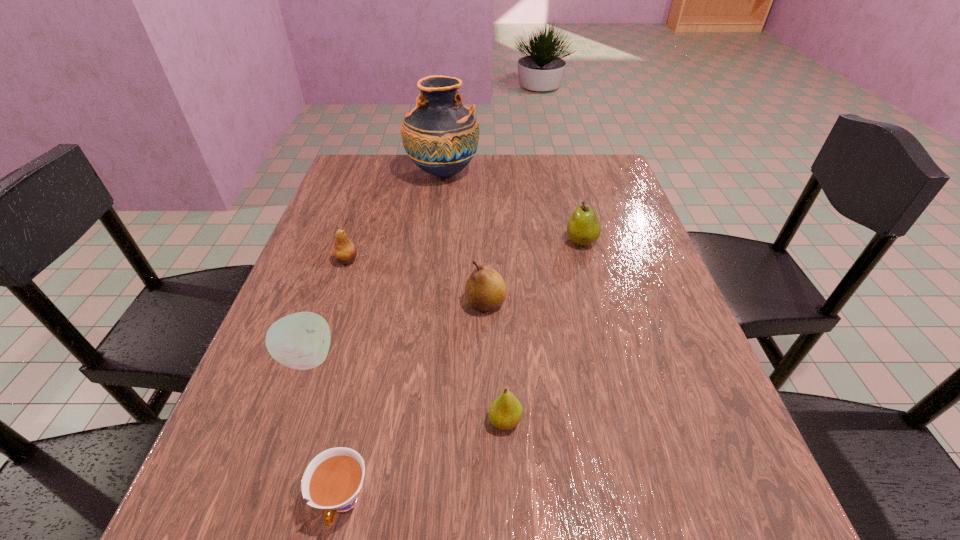
In order to click on the shortest object in this screenshot , I will do `click(332, 480)`.

You are a GUI agent. You are given a task and a screenshot of the screen. Output one action in this format:
    pyautogui.click(x=<x>, y=<y>)
    Task: Click on the vacant area located on the front of the tallest object
    
    Given the screenshot: What is the action you would take?
    pyautogui.click(x=438, y=216)

Identify the location of vacant space located on the front of the fifth nearest object. This screenshot has width=960, height=540. (319, 343).

Locate an element on the screen. The height and width of the screenshot is (540, 960). vacant region located on the right of the sixth nearest object is located at coordinates (639, 241).

Locate an element on the screen. vacant space located 0.110m on the back of the third farthest pear is located at coordinates (485, 255).

Locate an element on the screen. blank space located on the right of the fifth farthest object is located at coordinates (443, 357).

I want to click on free space located on the right of the second nearest object, so click(x=621, y=421).

I want to click on object that is at the far edge, so click(x=440, y=135).

You are a GUI agent. You are given a task and a screenshot of the screen. Output one action in this format:
    pyautogui.click(x=<x>, y=<y>)
    Task: Click on the object that is positioned at the near edge
    
    Given the screenshot: What is the action you would take?
    pyautogui.click(x=332, y=480)

Locate an element on the screen. The image size is (960, 540). pear that is at the left edge is located at coordinates (344, 251).